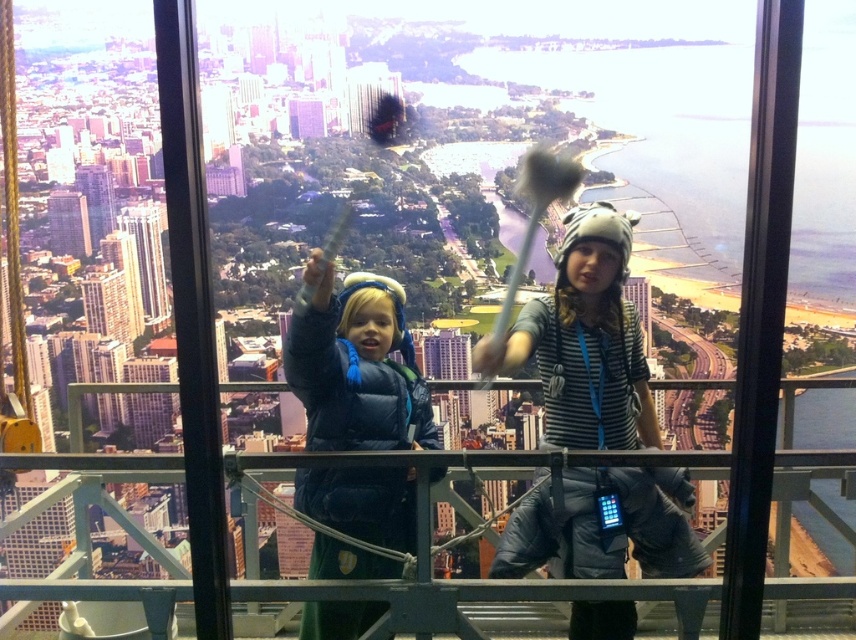
Question: Which point is farther to the camera?

Choices:
 (A) (379, 298)
 (B) (165, 307)
 (C) (51, 228)

Answer: (C)

Question: Is matte blue jacket at center in front of matte gray building at left?

Choices:
 (A) yes
 (B) no

Answer: (A)

Question: Which of these objects is positioned closest to the matte gray building at left?

Choices:
 (A) matte blue jacket at center
 (B) smooth glass skyscraper at center

Answer: (B)

Question: Is matte blue jacket at center to the left of smooth glass skyscraper at center from the viewer's perspective?

Choices:
 (A) yes
 (B) no

Answer: (B)

Question: Which point is closer to the camera?

Choices:
 (A) (51, 220)
 (B) (308, 326)

Answer: (B)

Question: From the image, what is the correct spatial relationship of matte gray building at left in relation to smooth glass skyscraper at center?

Choices:
 (A) below
 (B) above

Answer: (A)